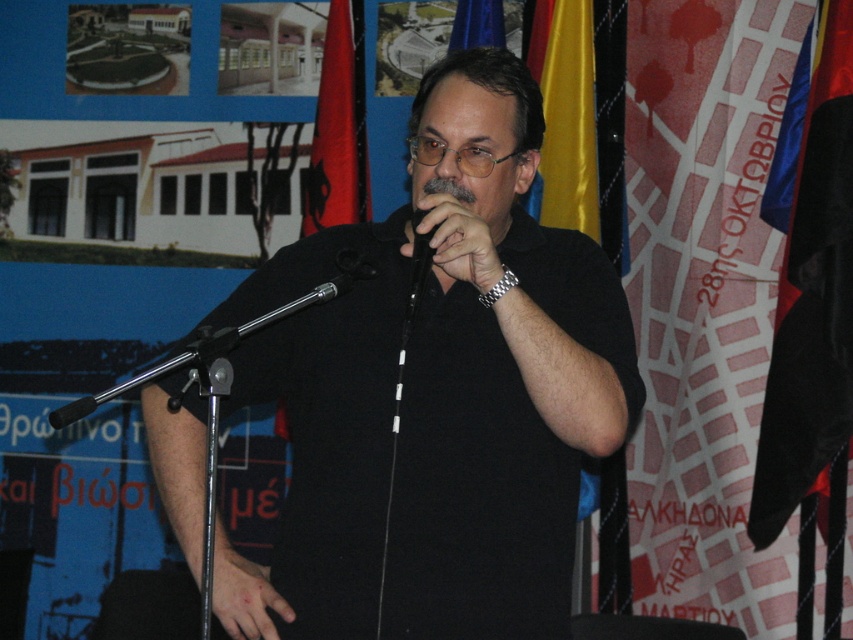
Does point (238, 616) come farther from viewer compared to point (128, 385)?

Yes, point (238, 616) is behind point (128, 385).

Locate an element on the screen. The height and width of the screenshot is (640, 853). leather skin at center is located at coordinates (244, 595).

In the scene shown: Which is more to the right, red fabric flag at upper center or black leather microphone at center?

Positioned to the right is black leather microphone at center.

Can you confirm if red fabric flag at upper center is positioned below black leather microphone at center?

No, red fabric flag at upper center is not below black leather microphone at center.

At what (x,y) coordinates should I click in order to perform the action: click on red fabric flag at upper center. Please return your answer as a coordinate pair (x, y). The image size is (853, 640). Looking at the image, I should click on (338, 125).

You are a GUI agent. You are given a task and a screenshot of the screen. Output one action in this format:
    pyautogui.click(x=<x>, y=<y>)
    Task: Click on the yellow satin flag at upper right
    
    Given the screenshot: What is the action you would take?
    pyautogui.click(x=566, y=113)

Is point (556, 49) closer to viewer compared to point (850, 10)?

No, it is not.

The image size is (853, 640). In order to click on yellow satin flag at upper right in this screenshot , I will do `click(566, 113)`.